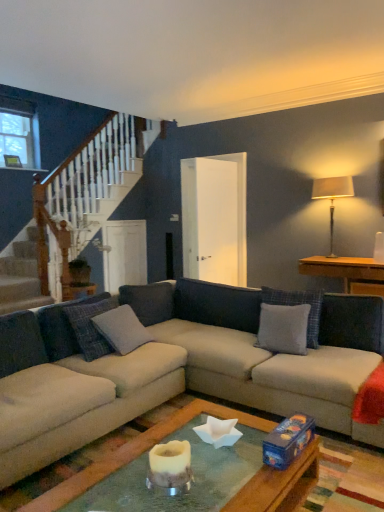
Question: Is gray fabric pillow at center, which ranks as the first pillow in left-to-right order, surrounding beige fabric couch at center?

Choices:
 (A) yes
 (B) no

Answer: (B)

Question: Is gray fabric pillow at center, acting as the 4th pillow starting from the right, positioned with its back to beige fabric couch at center?

Choices:
 (A) no
 (B) yes

Answer: (B)

Question: From the image's perspective, is gray fabric pillow at center, which ranks as the first pillow in left-to-right order, above beige fabric couch at center?

Choices:
 (A) no
 (B) yes

Answer: (B)

Question: Is gray fabric pillow at center, which ranks as the first pillow in left-to-right order, not inside beige fabric couch at center?

Choices:
 (A) yes
 (B) no

Answer: (B)

Question: Does gray fabric pillow at center, which ranks as the first pillow in left-to-right order, have a lesser width compared to beige fabric couch at center?

Choices:
 (A) no
 (B) yes

Answer: (B)

Question: Is gray fabric pillow at center, which ranks as the first pillow in left-to-right order, with beige fabric couch at center?

Choices:
 (A) yes
 (B) no

Answer: (B)

Question: Is wooden side table at right positioned far away from gray fabric pillow at center, arranged as the 2th pillow when viewed from the right?

Choices:
 (A) no
 (B) yes

Answer: (B)

Question: Is wooden side table at right to the left of gray fabric pillow at center, arranged as the 2th pillow when viewed from the right, from the viewer's perspective?

Choices:
 (A) yes
 (B) no

Answer: (B)

Question: Is wooden side table at right positioned before gray fabric pillow at center, the third pillow positioned from the left?

Choices:
 (A) yes
 (B) no

Answer: (B)

Question: From a real-world perspective, is wooden side table at right physically below gray fabric pillow at center, the third pillow positioned from the left?

Choices:
 (A) no
 (B) yes

Answer: (A)

Question: Is the depth of wooden side table at right greater than that of gray fabric pillow at center, the third pillow positioned from the left?

Choices:
 (A) no
 (B) yes

Answer: (B)

Question: Can you confirm if wooden side table at right is bigger than gray fabric pillow at center, arranged as the 2th pillow when viewed from the right?

Choices:
 (A) no
 (B) yes

Answer: (B)

Question: Would you say wooden side table at right contains gray fabric pillow at center, the 1th pillow positioned from the right?

Choices:
 (A) no
 (B) yes

Answer: (A)